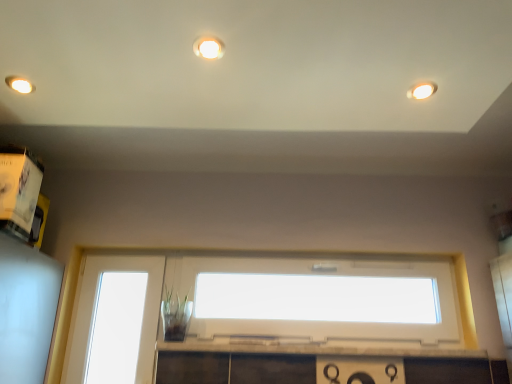
Question: From a real-world perspective, is matte white light fixture at upper right, positioned as the first lighting in bottom-to-top order, on matte white light fixture at upper left, which appears as the 2th lighting when ordered from the bottom?

Choices:
 (A) no
 (B) yes

Answer: (A)

Question: Is matte white light fixture at upper right, placed as the second lighting when sorted from back to front, bigger than matte white light fixture at upper left, marked as the first lighting in a back-to-front arrangement?

Choices:
 (A) yes
 (B) no

Answer: (B)

Question: Does matte white light fixture at upper right, placed as the second lighting when sorted from back to front, have a greater height compared to matte white light fixture at upper left, acting as the 3th lighting starting from the front?

Choices:
 (A) no
 (B) yes

Answer: (A)

Question: Is matte white light fixture at upper right, placed as the second lighting when sorted from back to front, wider than matte white light fixture at upper left, marked as the first lighting in a back-to-front arrangement?

Choices:
 (A) yes
 (B) no

Answer: (B)

Question: Does matte white light fixture at upper right, the 3th lighting viewed from the left, touch matte white light fixture at upper left, which is the 3th lighting from right to left?

Choices:
 (A) no
 (B) yes

Answer: (A)

Question: Is matte white light fixture at upper right, positioned as the 1th lighting in right-to-left order, aimed at matte white light fixture at upper left, which appears as the 2th lighting when ordered from the bottom?

Choices:
 (A) no
 (B) yes

Answer: (A)

Question: From a real-world perspective, is white plastic window at center, the second window from the left, on matte white light fixture at upper right, placed as the second lighting when sorted from back to front?

Choices:
 (A) yes
 (B) no

Answer: (B)

Question: Is white plastic window at center, the second window from the left, located outside matte white light fixture at upper right, marked as the third lighting in a top-to-bottom arrangement?

Choices:
 (A) yes
 (B) no

Answer: (A)

Question: Considering the relative positions of white plastic window at center, which is the 1th window from right to left, and matte white light fixture at upper right, positioned as the 1th lighting in right-to-left order, in the image provided, is white plastic window at center, which is the 1th window from right to left, to the right of matte white light fixture at upper right, positioned as the 1th lighting in right-to-left order, from the viewer's perspective?

Choices:
 (A) no
 (B) yes

Answer: (A)

Question: Would you consider white plastic window at center, the second window from the left, to be distant from matte white light fixture at upper right, marked as the 2th lighting in a front-to-back arrangement?

Choices:
 (A) no
 (B) yes

Answer: (B)

Question: Can you confirm if white plastic window at center, the second window from the left, is smaller than matte white light fixture at upper right, the 3th lighting viewed from the left?

Choices:
 (A) yes
 (B) no

Answer: (B)

Question: From a real-world perspective, is white plastic window at center, which is the 1th window from right to left, under matte white light fixture at upper right, marked as the third lighting in a top-to-bottom arrangement?

Choices:
 (A) no
 (B) yes

Answer: (B)

Question: Is transparent glass window at lower left, the 1th window in the left-to-right sequence, outside matte white light fixture at upper center, the 2th lighting from the left?

Choices:
 (A) no
 (B) yes

Answer: (B)